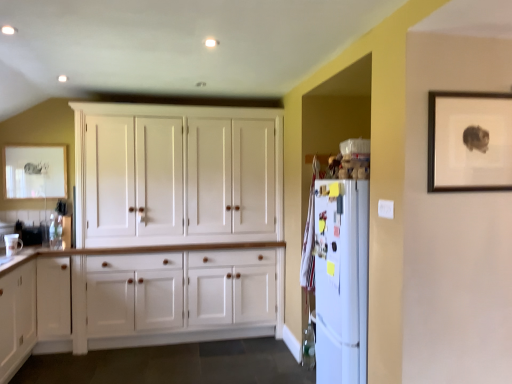
Question: In the image, is white wood cabinet at lower left positioned in front of or behind white wood cupboard at center?

Choices:
 (A) behind
 (B) front

Answer: (B)

Question: In the image, is white wood cabinet at lower left on the left side or the right side of white wood cupboard at center?

Choices:
 (A) left
 (B) right

Answer: (A)

Question: Which of these objects is positioned closest to the white glossy mug at lower left?

Choices:
 (A) white wood cabinet at lower left
 (B) white wood cupboard at center
 (C) white wood cabinet at lower left
 (D) white matte refrigerator at right
 (E) wooden picture frame at upper right, marked as the 1th picture frame in a front-to-back arrangement

Answer: (C)

Question: Estimate the real-world distances between objects in this image. Which object is farther from the white glossy mug at lower left?

Choices:
 (A) white wood cupboard at center
 (B) white matte refrigerator at right
 (C) white wood cabinet at lower left
 (D) white wood cabinet at lower left
 (E) matte white picture frame at upper left, which is counted as the first picture frame, starting from the back

Answer: (B)